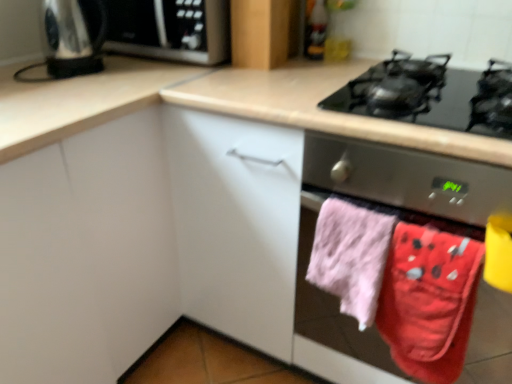
Question: Can we say white matte cabinet at center, which appears as the 2th cabinetry when viewed from the right, lies outside red cotton beach towel at lower right, acting as the second beach towel starting from the left?

Choices:
 (A) no
 (B) yes

Answer: (B)

Question: Is white matte cabinet at center, which appears as the 2th cabinetry when viewed from the right, in contact with red cotton beach towel at lower right, arranged as the 1th beach towel when viewed from the right?

Choices:
 (A) no
 (B) yes

Answer: (A)

Question: Is white matte cabinet at center, positioned as the second cabinetry in back-to-front order, positioned before red cotton beach towel at lower right, arranged as the 1th beach towel when viewed from the right?

Choices:
 (A) no
 (B) yes

Answer: (B)

Question: From the image's perspective, is white matte cabinet at center, the first cabinetry positioned from the left, on red cotton beach towel at lower right, acting as the second beach towel starting from the left?

Choices:
 (A) yes
 (B) no

Answer: (A)

Question: Considering the relative sizes of white matte cabinet at center, which appears as the 1th cabinetry when viewed from the front, and red cotton beach towel at lower right, arranged as the 1th beach towel when viewed from the right, in the image provided, is white matte cabinet at center, which appears as the 1th cabinetry when viewed from the front, bigger than red cotton beach towel at lower right, arranged as the 1th beach towel when viewed from the right,?

Choices:
 (A) yes
 (B) no

Answer: (A)

Question: Is pink fluffy towel at lower right, which is the 2th beach towel in right-to-left order, taller or shorter than matte wood cabinet at upper center, the second cabinetry when ordered from front to back?

Choices:
 (A) tall
 (B) short

Answer: (A)

Question: Is pink fluffy towel at lower right, which is the 2th beach towel in right-to-left order, in front of or behind matte wood cabinet at upper center, the 1th cabinetry viewed from the back, in the image?

Choices:
 (A) behind
 (B) front

Answer: (B)

Question: Is pink fluffy towel at lower right, which is the 2th beach towel in right-to-left order, to the left or to the right of matte wood cabinet at upper center, the second cabinetry when ordered from front to back, in the image?

Choices:
 (A) right
 (B) left

Answer: (A)

Question: Does point (355, 296) appear closer or farther from the camera than point (268, 64)?

Choices:
 (A) closer
 (B) farther

Answer: (A)

Question: In the image, is red cotton beach towel at lower right, arranged as the 1th beach towel when viewed from the right, on the left side or the right side of pink fluffy towel at lower right, which is the 2th beach towel in right-to-left order?

Choices:
 (A) left
 (B) right

Answer: (B)

Question: In terms of height, does red cotton beach towel at lower right, arranged as the 1th beach towel when viewed from the right, look taller or shorter compared to pink fluffy towel at lower right, which is the 2th beach towel in right-to-left order?

Choices:
 (A) tall
 (B) short

Answer: (A)

Question: Based on their sizes in the image, would you say red cotton beach towel at lower right, acting as the second beach towel starting from the left, is bigger or smaller than pink fluffy towel at lower right, marked as the first beach towel in a left-to-right arrangement?

Choices:
 (A) big
 (B) small

Answer: (B)

Question: Looking at their shapes, would you say red cotton beach towel at lower right, acting as the second beach towel starting from the left, is wider or thinner than pink fluffy towel at lower right, which is the 2th beach towel in right-to-left order?

Choices:
 (A) thin
 (B) wide

Answer: (A)

Question: Based on their sizes in the image, would you say red cotton beach towel at lower right, arranged as the 1th beach towel when viewed from the right, is bigger or smaller than black glass gas stove at upper right?

Choices:
 (A) big
 (B) small

Answer: (B)

Question: Is point (381, 329) closer or farther from the camera than point (453, 122)?

Choices:
 (A) closer
 (B) farther

Answer: (A)